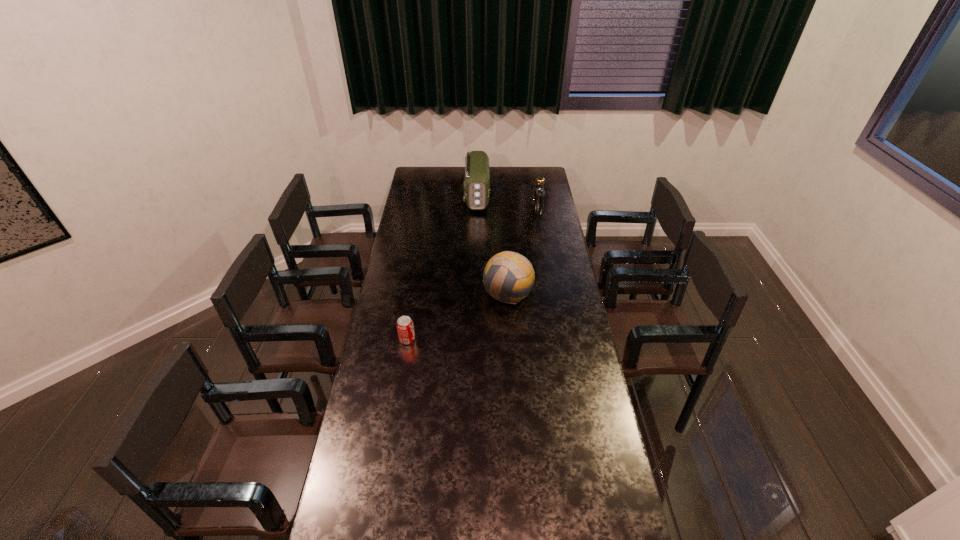
Locate an element on the screen. The width and height of the screenshot is (960, 540). vacant space that satisfies the following two spatial constraints: 1. on the front-facing side of the radio_receiver; 2. on the right side of the volleyball is located at coordinates (476, 293).